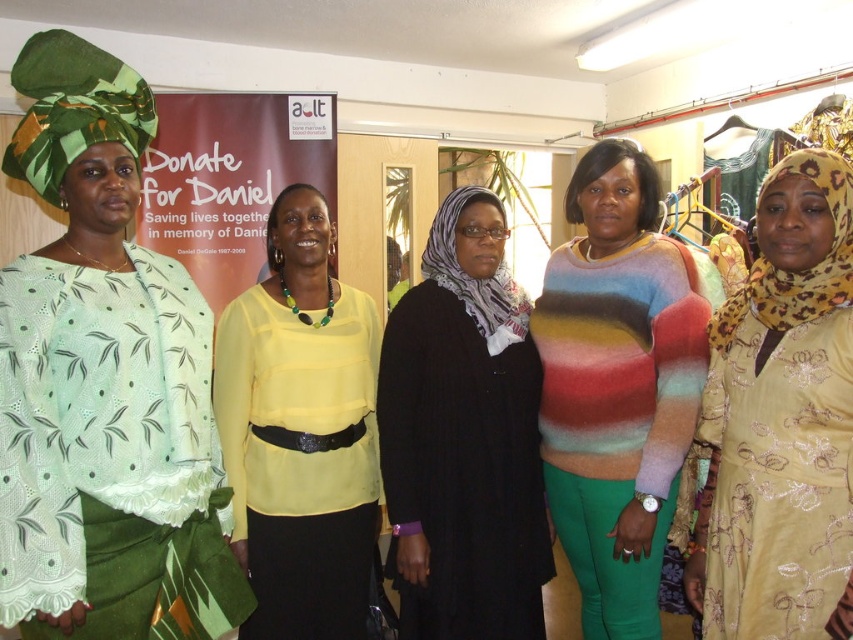
Is matte green fabric at left positioned behind multicolored fuzzy sweater at center?

That is False.

Looking at this image, is matte green fabric at left positioned in front of multicolored fuzzy sweater at center?

That is True.

Is point (90, 625) behind point (538, 337)?

No, it is not.

The height and width of the screenshot is (640, 853). Identify the location of matte green fabric at left. (103, 384).

Measure the distance between matte green fabric at left and camera.

matte green fabric at left and camera are 4.15 feet apart.

Is matte green fabric at left positioned before yellow satin blouse at center?

Yes.

Is point (212, 436) less distant than point (238, 509)?

Yes, point (212, 436) is in front of point (238, 509).

Where is `matte green fabric at left`? matte green fabric at left is located at coordinates (103, 384).

Identify the location of gold embroidered dress at right. The image size is (853, 640). (781, 420).

Does gold embroidered dress at right have a lesser width compared to yellow satin blouse at center?

Yes.

Describe the element at coordinates (781, 420) in the screenshot. I see `gold embroidered dress at right` at that location.

Where is `gold embroidered dress at right`? gold embroidered dress at right is located at coordinates (781, 420).